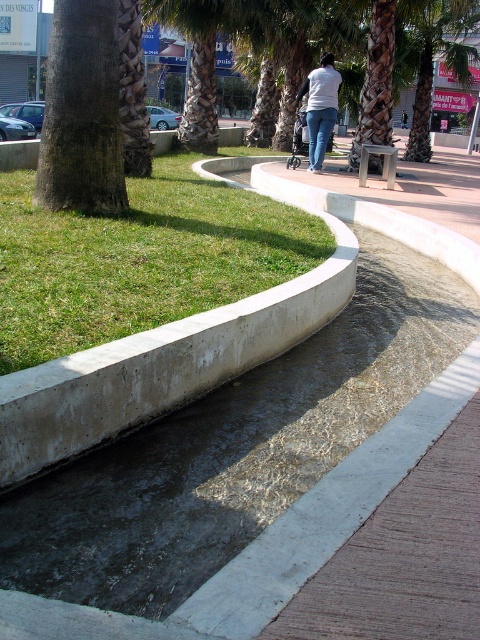
You are standing in the landscaped urban area and want to walk from the point closer to you to the point further away. Which path would you take between the two points, point [118,321] and point [315,76]?

You should walk from point [118,321] to point [315,76] because point [118,321] is closer to the viewer and the other point is further away.

You are standing in the urban landscape and notice a green leafy palm tree at upper center and a white matte shirt at center. Which object is shorter in height?

The green leafy palm tree at upper center is shorter than the white matte shirt at center.